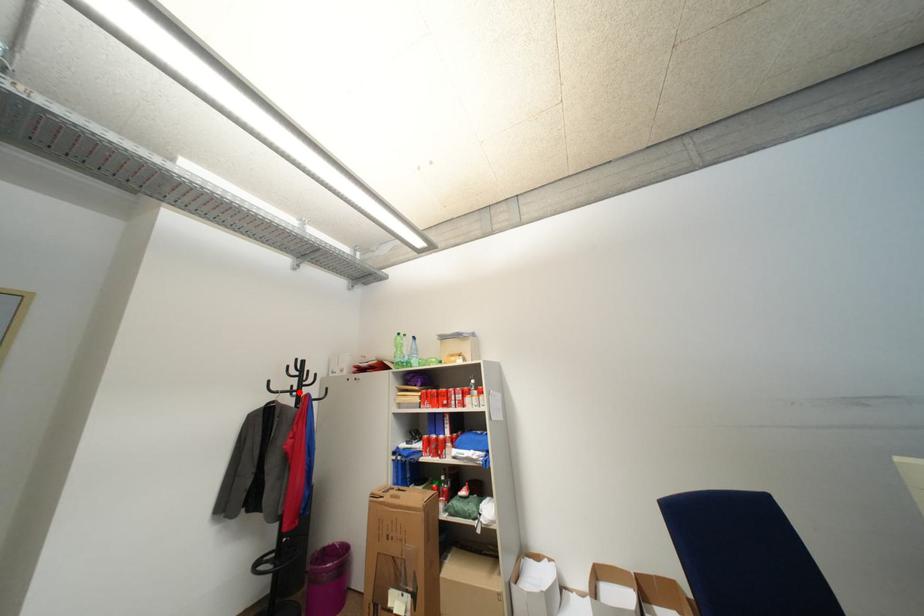
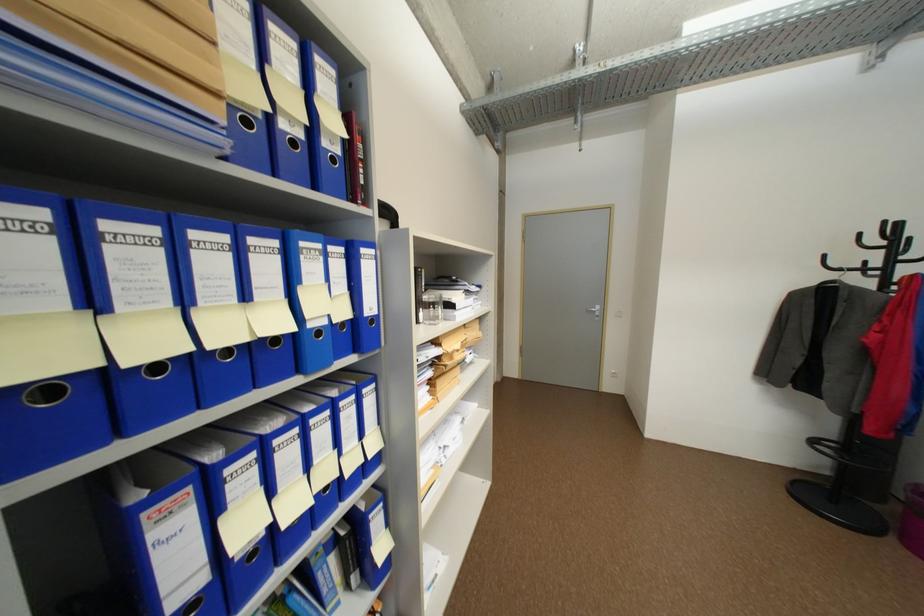
Where in the second image is the point corresponding to the highlighted location from the first image?

(873, 270)